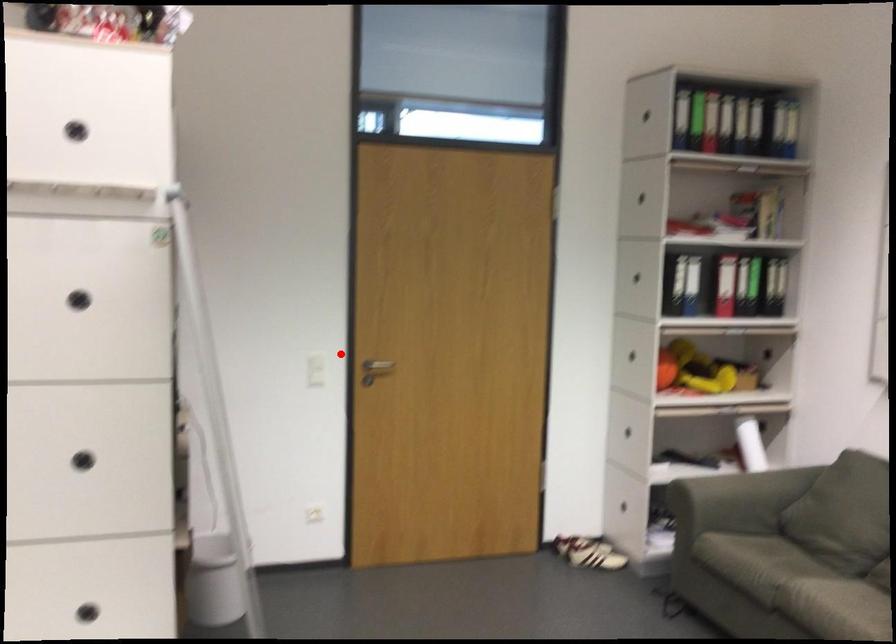
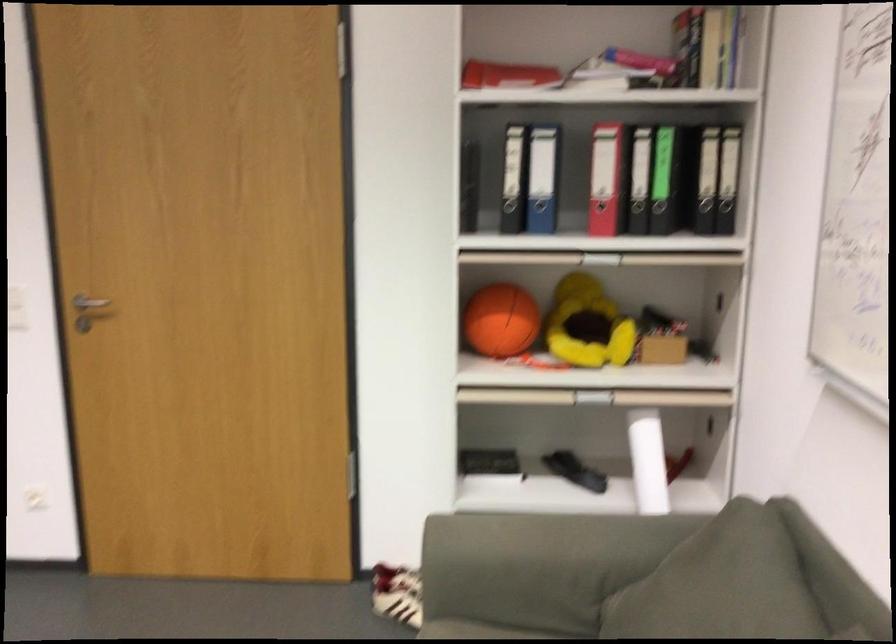
Question: I am providing you with two images of the same scene from different viewpoints. Image1 has a red point marked. In image2, the corresponding 3D location appears at what relative position? Reply with the corresponding letter.

Choices:
 (A) Closer
 (B) Farther

Answer: (A)